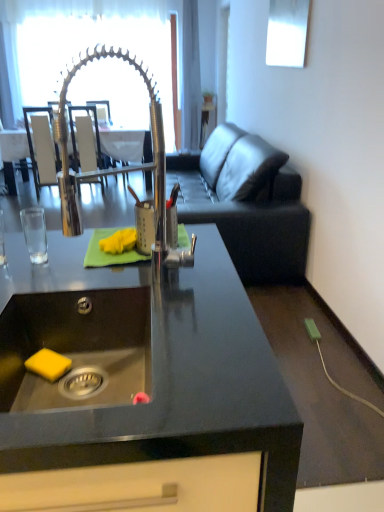
The image size is (384, 512). Identify the location of vacant region to the right of polished chrome tap at center. (209, 290).